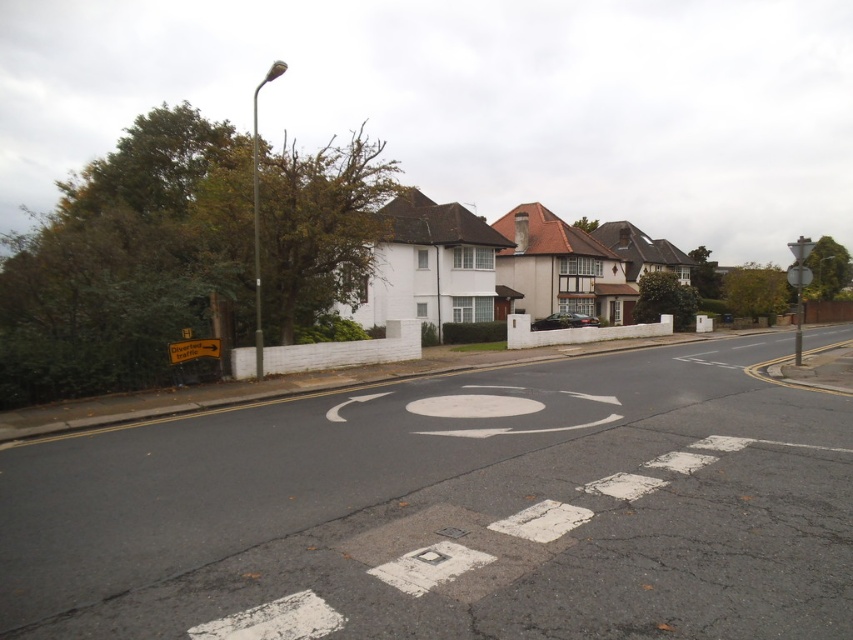
Can you confirm if metallic silver street sign at right is positioned to the right of yellow plastic sign at lower left?

Correct, you'll find metallic silver street sign at right to the right of yellow plastic sign at lower left.

Can you confirm if metallic silver street sign at right is positioned to the left of yellow plastic sign at lower left?

No, metallic silver street sign at right is not to the left of yellow plastic sign at lower left.

You are a GUI agent. You are given a task and a screenshot of the screen. Output one action in this format:
    pyautogui.click(x=<x>, y=<y>)
    Task: Click on the metallic silver street sign at right
    The image size is (853, 640).
    Given the screenshot: What is the action you would take?
    pyautogui.click(x=799, y=284)

Who is higher up, white painted circle at center or metallic silver street sign at right?

metallic silver street sign at right

The width and height of the screenshot is (853, 640). What do you see at coordinates (477, 403) in the screenshot? I see `white painted circle at center` at bounding box center [477, 403].

Does point (462, 433) come in front of point (799, 310)?

Yes, it is.

Find the location of a particular element. This screenshot has height=640, width=853. white painted circle at center is located at coordinates (477, 403).

Is white painted circle at center wider than yellow plastic sign at lower left?

Yes, white painted circle at center is wider than yellow plastic sign at lower left.

Between point (451, 397) and point (170, 356), which one is positioned in front?

Positioned in front is point (451, 397).

I want to click on white painted circle at center, so click(477, 403).